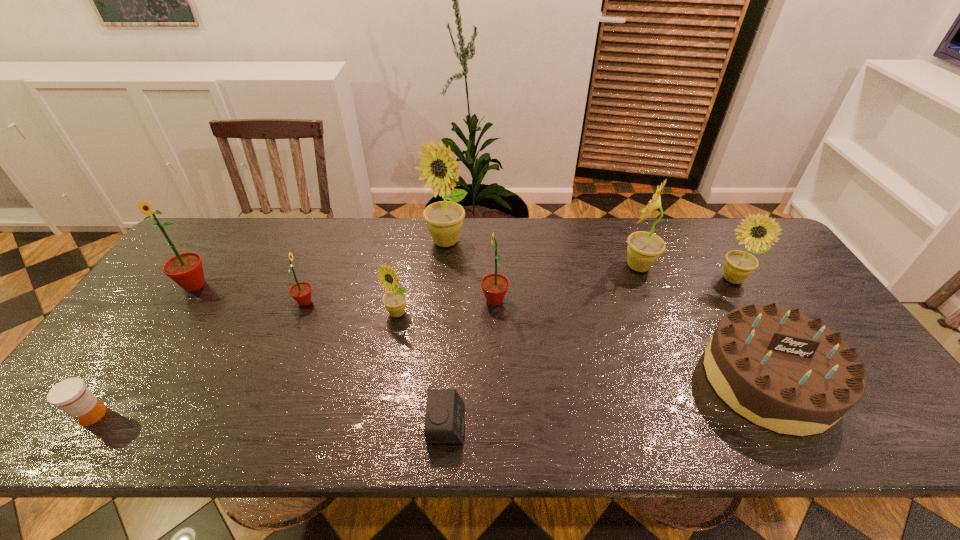
This screenshot has height=540, width=960. I want to click on vacant space located on the face of the second sunflower from right to left, so click(551, 266).

Locate an element on the screen. This screenshot has height=540, width=960. free space located on the face of the second sunflower from right to left is located at coordinates (509, 266).

The height and width of the screenshot is (540, 960). I want to click on vacant point located on the face of the second sunflower from right to left, so click(x=597, y=266).

Find the location of a particular element. The height and width of the screenshot is (540, 960). vacant area situated on the face of the leftmost sunflower is located at coordinates (167, 326).

This screenshot has height=540, width=960. What are the coordinates of `free space located 0.130m on the face of the fourth object from right to left` in the screenshot? It's located at (435, 300).

The height and width of the screenshot is (540, 960). Identify the location of free space located on the face of the fourth object from right to left. (431, 300).

At what (x,y) coordinates should I click in order to perform the action: click on vacant space located on the face of the fourth object from right to left. Please return your answer as a coordinate pair (x, y). Image resolution: width=960 pixels, height=540 pixels. Looking at the image, I should click on pos(431,300).

Where is `blank space located 0.240m on the face of the third biggest yellow sunflower`? blank space located 0.240m on the face of the third biggest yellow sunflower is located at coordinates (780, 357).

Identify the location of vacant area situated 0.100m on the face of the smallest green sunflower. This screenshot has height=540, width=960. (350, 302).

Where is `vacant space positioned on the face of the smallest yellow sunflower`? vacant space positioned on the face of the smallest yellow sunflower is located at coordinates (387, 366).